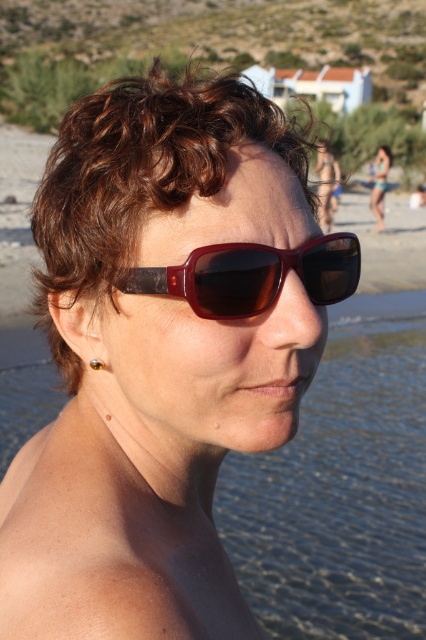
Question: Which point is farther to the camera?

Choices:
 (A) matte brown sunglasses at upper right
 (B) matte brown sunglasses at center
 (C) dry skin at lower left

Answer: (A)

Question: Observing the image, what is the correct spatial positioning of dry skin at lower left in reference to shiny brown plastic goggles at center?

Choices:
 (A) below
 (B) above

Answer: (A)

Question: Which is nearer to the dry skin at lower left?

Choices:
 (A) brown curly hair at center
 (B) shiny brown plastic goggles at center
 (C) matte brown sunglasses at upper right

Answer: (B)

Question: Considering the real-world distances, which object is farthest from the clear water at shoulder?

Choices:
 (A) matte brown sunglasses at upper right
 (B) brown curly hair at center

Answer: (A)

Question: Is clear water at shoulder smaller than shiny brown plastic goggles at center?

Choices:
 (A) yes
 (B) no

Answer: (B)

Question: Is dry skin at lower left closer to the viewer compared to matte brown sunglasses at center?

Choices:
 (A) no
 (B) yes

Answer: (B)